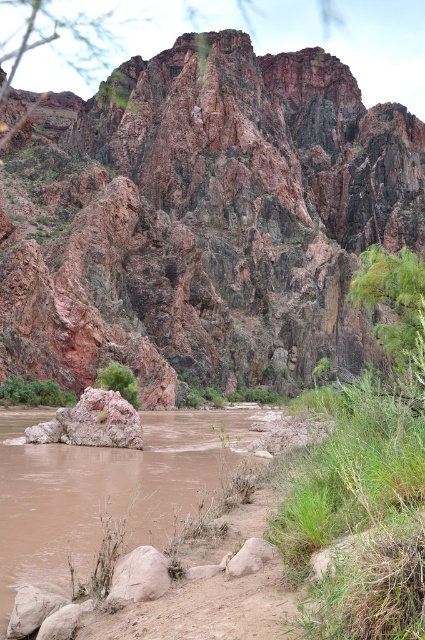
Question: Which object is the closest to the rusty rock formation at center?

Choices:
 (A) smooth beige rock at lower center
 (B) green grass at lower left
 (C) green grass at right
 (D) brown muddy water at lower left

Answer: (C)

Question: Considering the relative positions of green grass at right and brown muddy water at lower left in the image provided, where is green grass at right located with respect to brown muddy water at lower left?

Choices:
 (A) left
 (B) right

Answer: (B)

Question: Is smooth beige rock at lower center thinner than green leafy bush at center?

Choices:
 (A) no
 (B) yes

Answer: (B)

Question: Can you confirm if rusty rock formation at center is thinner than green leafy bush at center?

Choices:
 (A) no
 (B) yes

Answer: (A)

Question: Which object is farther from the camera taking this photo?

Choices:
 (A) green grass at lower left
 (B) green grass at right

Answer: (A)

Question: Estimate the real-world distances between objects in this image. Which object is closer to the smooth beige rock at lower center?

Choices:
 (A) green grass at lower left
 (B) green leafy bush at center
 (C) green grass at right

Answer: (C)